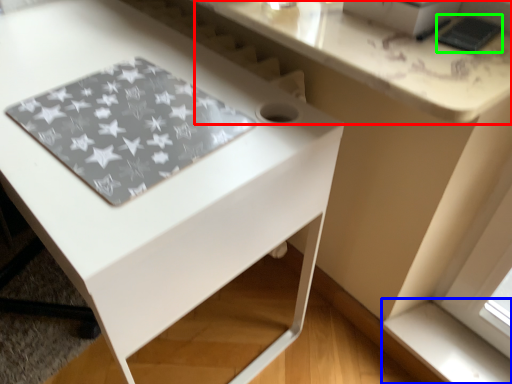
Question: Which object is the closest to the counter top (highlighted by a red box)? Choose among these: window sill (highlighted by a blue box) or pad (highlighted by a green box).

Choices:
 (A) window sill
 (B) pad

Answer: (B)